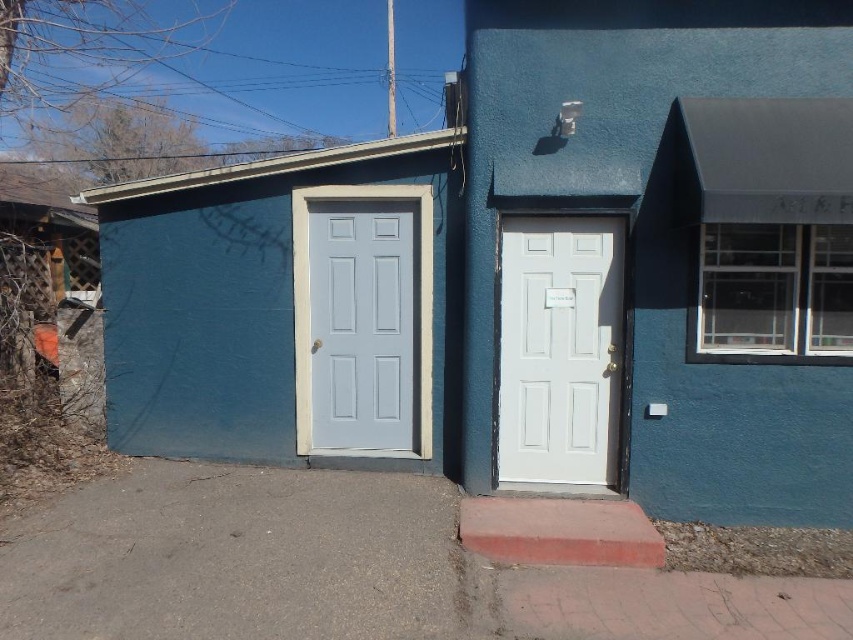
You are a delivery person trying to determine which door to use for a large package. The package requires a door that is wider than 3 feet. Given the white matte door at center and the light blue painted wood door at left, which door should you choose?

The white matte door at center is wider than the light blue painted wood door at left, so you should choose the white matte door at center for the large package.